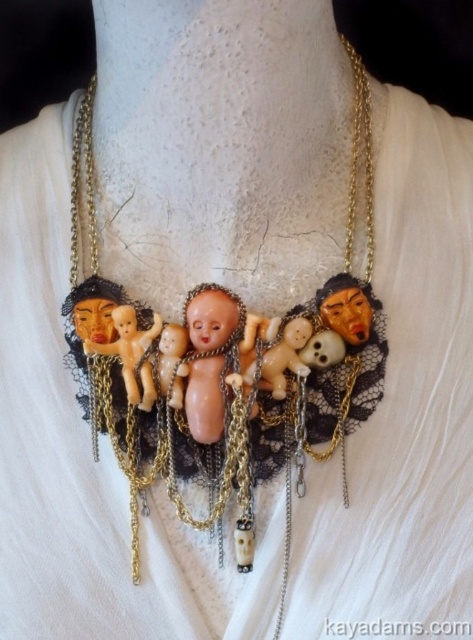
Who is more distant from viewer, (291, 428) or (200, 406)?

The point (291, 428) is more distant.

Can you confirm if matte porcelain dolls at center is thinner than pink porcelain doll at center?

No.

Does point (291, 419) come closer to viewer compared to point (218, 356)?

No, (291, 419) is behind (218, 356).

Image resolution: width=473 pixels, height=640 pixels. Find the location of `matte porcelain dolls at center`. matte porcelain dolls at center is located at coordinates (225, 369).